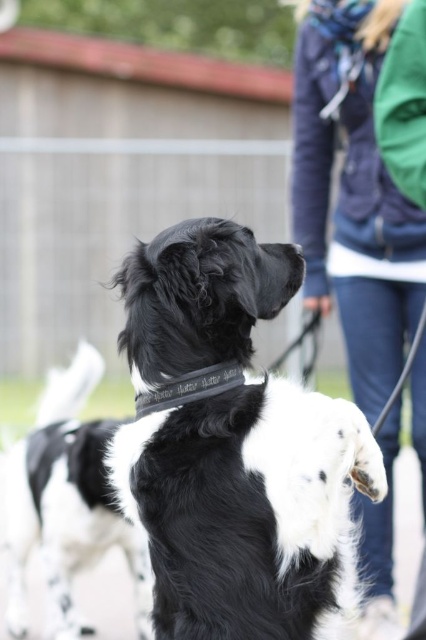
Does black and white fur dog at center have a greater width compared to black leather neckband at center?

Yes, black and white fur dog at center is wider than black leather neckband at center.

Does point (285, 488) lie in front of point (143, 404)?

Yes, it is.

Which is in front, point (204, 529) or point (213, 378)?

Point (204, 529) is more forward.

The height and width of the screenshot is (640, 426). In order to click on black and white fur dog at center in this screenshot , I will do `click(247, 508)`.

Who is taller, black and white fur at center or black leather neckband at center?

With more height is black and white fur at center.

Image resolution: width=426 pixels, height=640 pixels. What are the coordinates of `black and white fur at center` in the screenshot? It's located at (68, 502).

Is denim jacket at upper center closer to camera compared to black leather neckband at center?

No.

Between denim jacket at upper center and black leather neckband at center, which one has more height?

Standing taller between the two is denim jacket at upper center.

Is point (374, 291) farther from viewer compared to point (189, 397)?

Yes, it is.

This screenshot has height=640, width=426. Identify the location of denim jacket at upper center. click(354, 193).